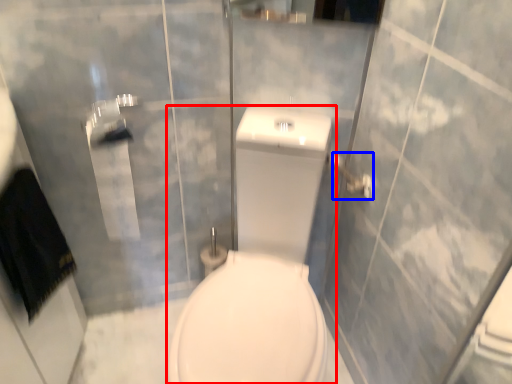
Question: Which point is further to the camera, porcelain (highlighted by a red box) or towel bar (highlighted by a blue box)?

Choices:
 (A) porcelain
 (B) towel bar

Answer: (B)